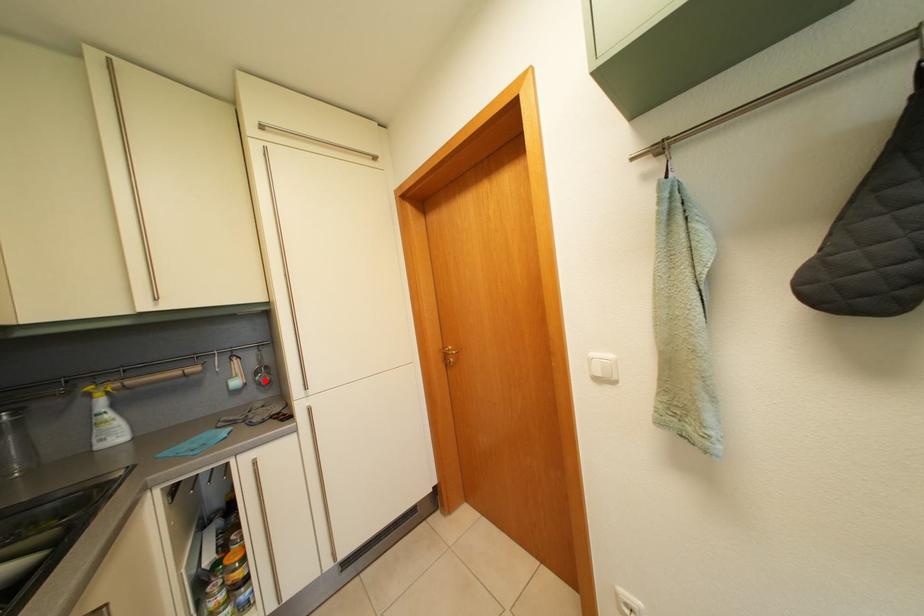
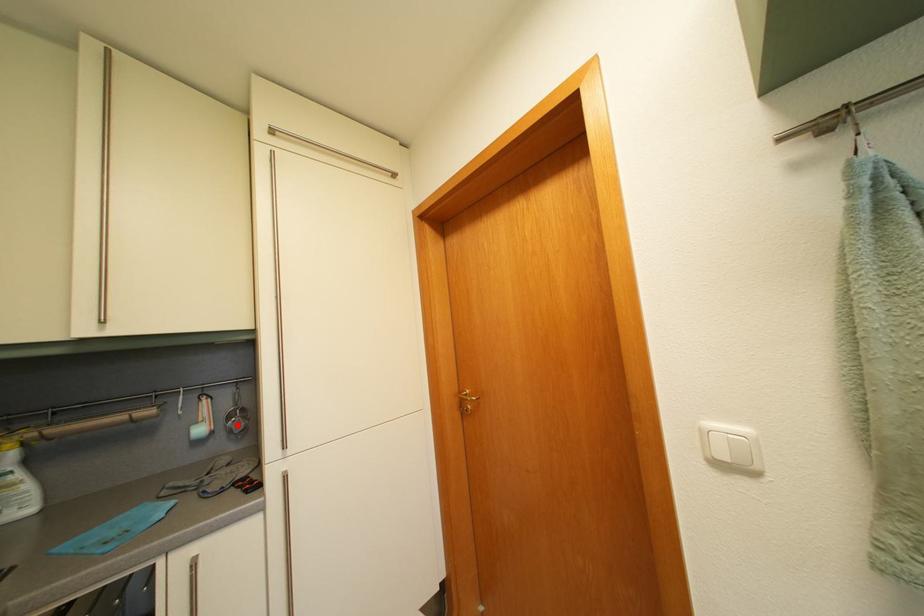
I am providing you with two images of the same scene from different viewpoints. A red point is marked on the first image and another point is marked on the second image. Are the points marked in image1 and image2 representing the same 3D position?

Yes